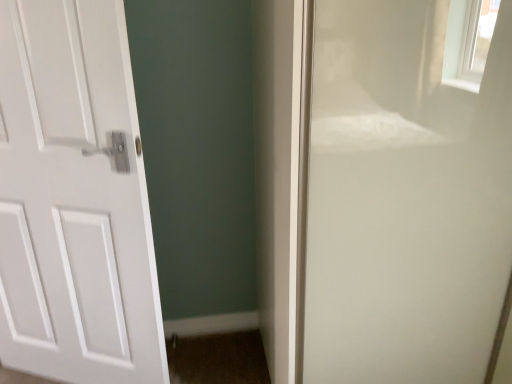
Question: Is point (422, 26) closer or farther from the camera than point (79, 188)?

Choices:
 (A) farther
 (B) closer

Answer: (B)

Question: Would you say transparent glass screen door at right is to the left or to the right of white matte door at left in the picture?

Choices:
 (A) right
 (B) left

Answer: (A)

Question: In terms of height, does transparent glass screen door at right look taller or shorter compared to white matte door at left?

Choices:
 (A) tall
 (B) short

Answer: (A)

Question: Is point click(x=34, y=91) closer or farther from the camera than point click(x=345, y=66)?

Choices:
 (A) closer
 (B) farther

Answer: (B)

Question: From the image's perspective, is white matte door at left located above or below transparent glass screen door at right?

Choices:
 (A) above
 (B) below

Answer: (B)

Question: Is white matte door at left in front of or behind transparent glass screen door at right in the image?

Choices:
 (A) front
 (B) behind

Answer: (B)

Question: From a real-world perspective, is white matte door at left positioned above or below transparent glass screen door at right?

Choices:
 (A) above
 (B) below

Answer: (A)